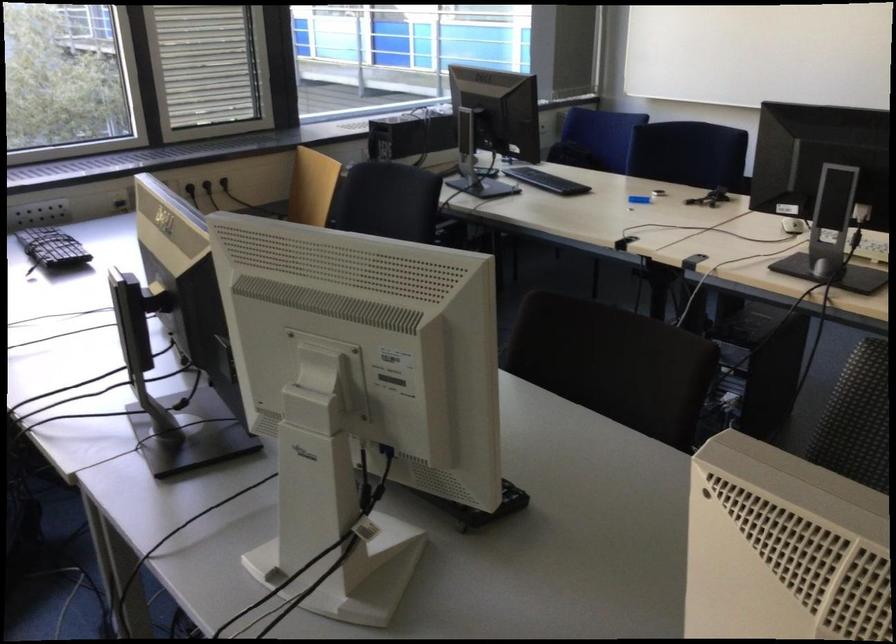
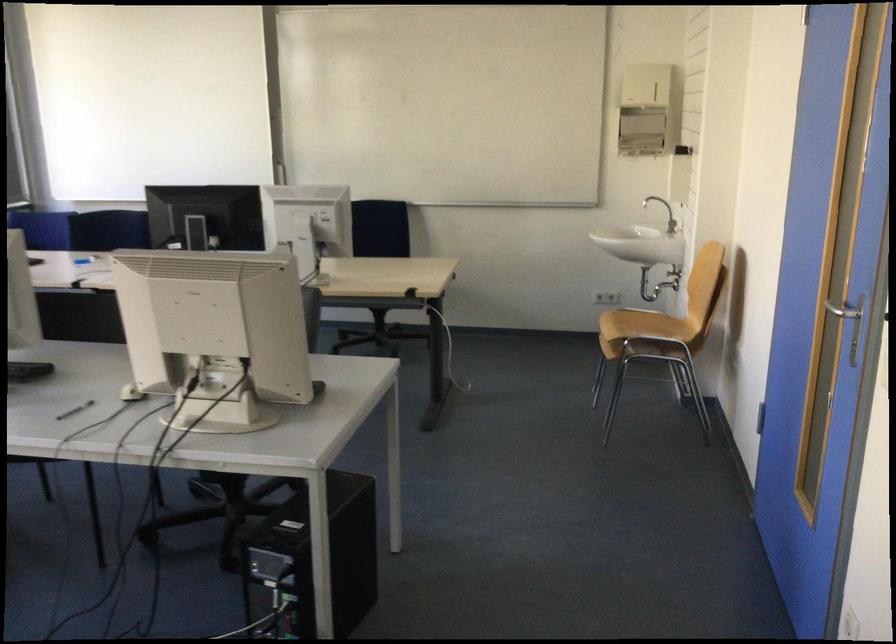
Question: I am providing you with two images of the same scene from different viewpoints. Please identify which objects are invisible in image2.

Choices:
 (A) chair sitting surface
 (B) small blue object
 (C) black pen
 (D) bottle pump handle

Answer: (B)